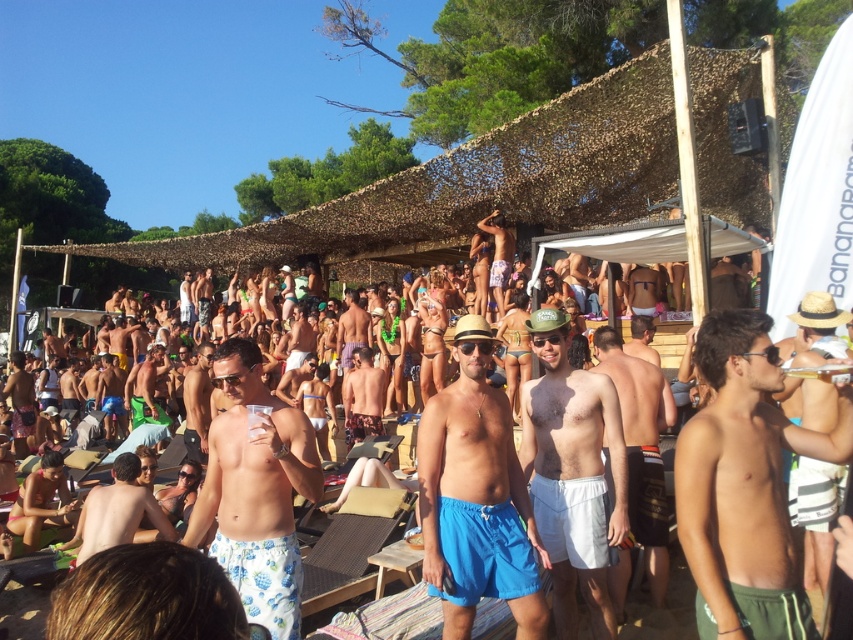
Question: Estimate the real-world distances between objects in this image. Which object is closer to the camouflage-patterned shorts at center?

Choices:
 (A) green cotton shorts at center
 (B) smooth tan skin at lower left
 (C) green fabric towel at center
 (D) straw hat at center

Answer: (B)

Question: Which point is closer to the camera?

Choices:
 (A) tap(357, 412)
 (B) tap(509, 248)
 (C) tap(132, 419)
 (D) tap(732, 465)

Answer: (D)

Question: Which object is positioned closest to the green cotton shorts at center?

Choices:
 (A) green fabric towel at center
 (B) straw hat at center

Answer: (B)

Question: Does green fabric towel at center appear over matte brown hair at center?

Choices:
 (A) no
 (B) yes

Answer: (A)

Question: Can you confirm if white matte shorts at center is positioned to the right of white cotton shorts at center?

Choices:
 (A) no
 (B) yes

Answer: (A)

Question: Can you confirm if straw hat at center is wider than camouflage-patterned shorts at center?

Choices:
 (A) yes
 (B) no

Answer: (A)